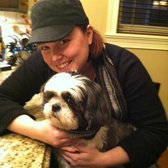
You are a GUI agent. You are given a task and a screenshot of the screen. Output one action in this format:
    pyautogui.click(x=<x>, y=<y>)
    Task: Click on the kitchen countertop
    This screenshot has width=168, height=168.
    Given the screenshot: What is the action you would take?
    (16, 156)